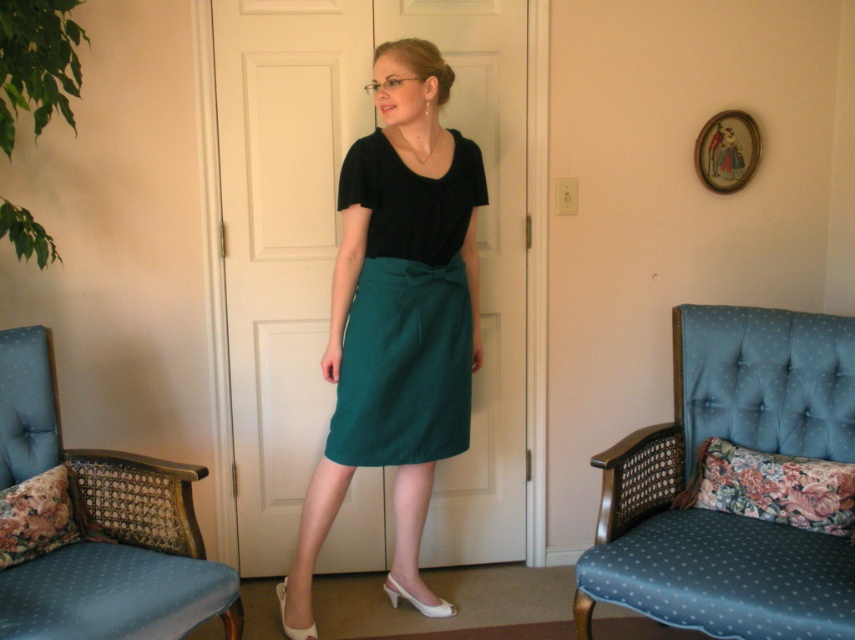
You are standing in the living room and want to sit down. There are two blue fabric armchairs in the room. One is on the left side of the frame, and the other is on the right side. If you want to sit in the chair at point (x=728, y=513), which one should you choose?

The blue fabric armchair at right is located at point (x=728, y=513), so you should choose the blue fabric armchair at right.

You are a photographer setting up for a portrait. The subject is wearing an emerald green fabric skirt at center. If your camera is positioned 2.21 meters away from the skirt, will you be able to capture the entire skirt in the frame without moving closer or farther?

Yes, since the camera is exactly 2.21 meters away from the emerald green fabric skirt at center, which is the specified distance in the description, the entire skirt should be in frame without needing to adjust the camera position.

You are a furniture designer trying to arrange a living room. You have a blue fabric armchair at right and a teal fabric skirt at center. Which object is shorter in height?

The blue fabric armchair at right is shorter in height compared to the teal fabric skirt at center.